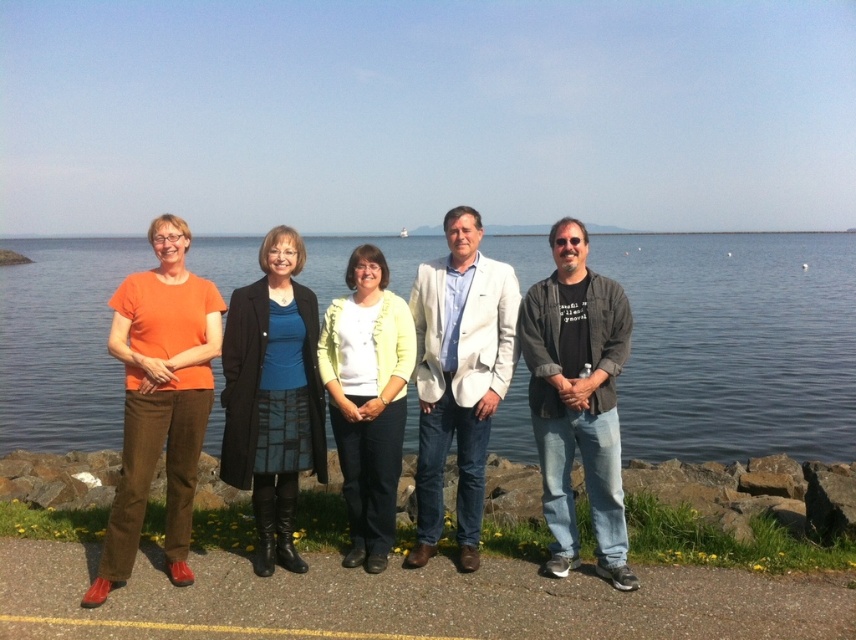
Question: Which point is farther to the camera?

Choices:
 (A) blue silk blouse at center
 (B) matte orange shirt at center

Answer: (A)

Question: Can you confirm if blue water at center is thinner than dark gray textured jacket at right?

Choices:
 (A) yes
 (B) no

Answer: (B)

Question: Can you confirm if blue silk blouse at center is wider than light yellow cardigan at center?

Choices:
 (A) yes
 (B) no

Answer: (A)

Question: Is matte orange shirt at center smaller than orange cotton shirt at left?

Choices:
 (A) yes
 (B) no

Answer: (A)

Question: Among these objects, which one is farthest from the camera?

Choices:
 (A) matte orange shirt at center
 (B) orange cotton shirt at left

Answer: (B)

Question: Estimate the real-world distances between objects in this image. Which object is farther from the blue silk blouse at center?

Choices:
 (A) orange cotton shirt at left
 (B) blue water at center
 (C) light yellow cardigan at center

Answer: (B)